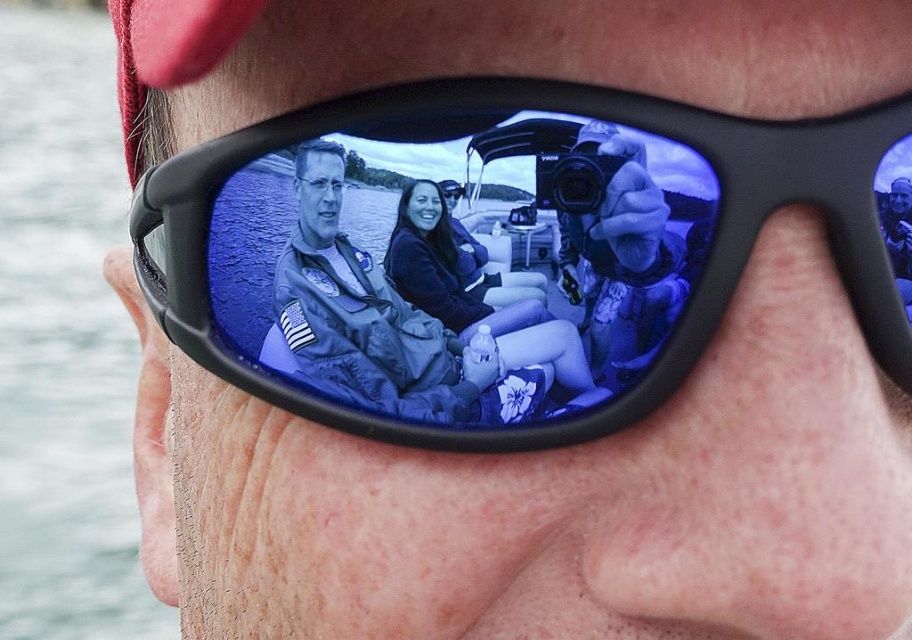
Is black plastic sunglasses at center bigger than clear water at lower left?

Actually, black plastic sunglasses at center might be smaller than clear water at lower left.

Is point (567, 154) positioned behind point (47, 198)?

No, (567, 154) is in front of (47, 198).

What do you see at coordinates (503, 250) in the screenshot?
I see `black plastic sunglasses at center` at bounding box center [503, 250].

Locate an element on the screen. black plastic sunglasses at center is located at coordinates (503, 250).